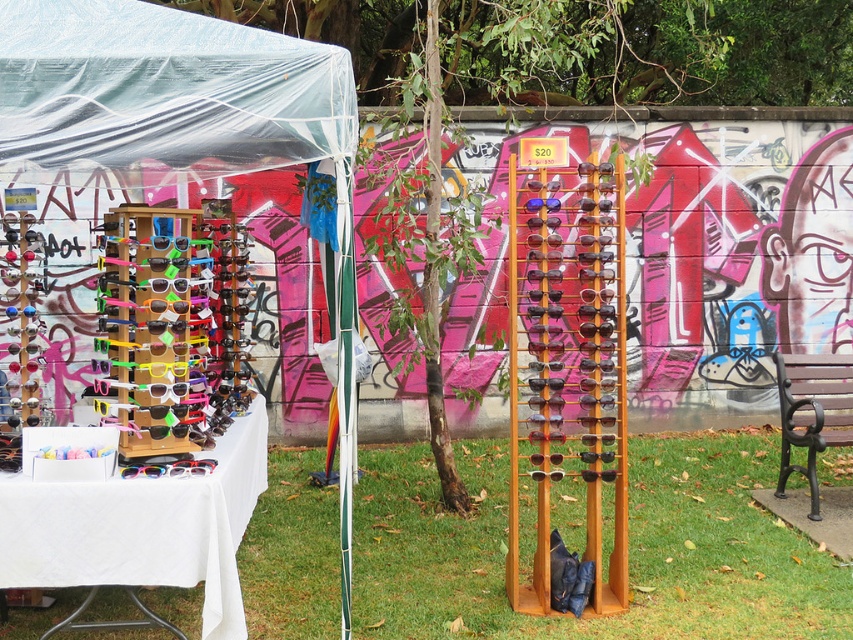
Can you confirm if wooden sunglasses stand at left is positioned to the right of rainbow plastic sunglasses at lower left?

No, wooden sunglasses stand at left is not to the right of rainbow plastic sunglasses at lower left.

Is wooden sunglasses stand at left above rainbow plastic sunglasses at lower left?

Yes, wooden sunglasses stand at left is above rainbow plastic sunglasses at lower left.

Who is more forward, (56, 122) or (181, 460)?

Positioned in front is point (56, 122).

Identify the location of wooden sunglasses stand at left. The height and width of the screenshot is (640, 853). (165, 96).

Can you confirm if wooden sunglasses stand at left is positioned to the right of brown wooden park bench at lower right?

No, wooden sunglasses stand at left is not to the right of brown wooden park bench at lower right.

Is wooden sunglasses stand at left above brown wooden park bench at lower right?

Indeed, wooden sunglasses stand at left is positioned over brown wooden park bench at lower right.

Locate an element on the screen. wooden sunglasses stand at left is located at coordinates (165, 96).

Which is behind, point (59, 556) or point (817, 492)?

The point (817, 492) is more distant.

Locate an element on the screen. The height and width of the screenshot is (640, 853). white fabric table at left is located at coordinates (142, 528).